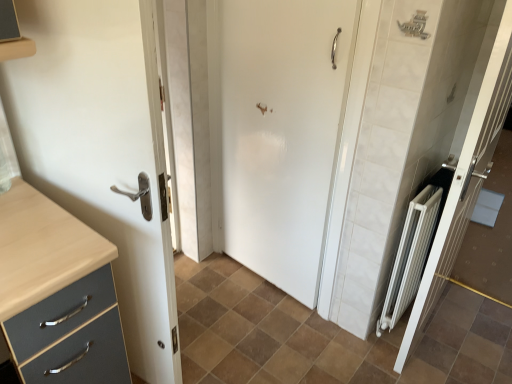
Find the location of a particular element. The width and height of the screenshot is (512, 384). free space to the right of white glossy door at left, which appears as the third door when viewed from the right is located at coordinates (229, 339).